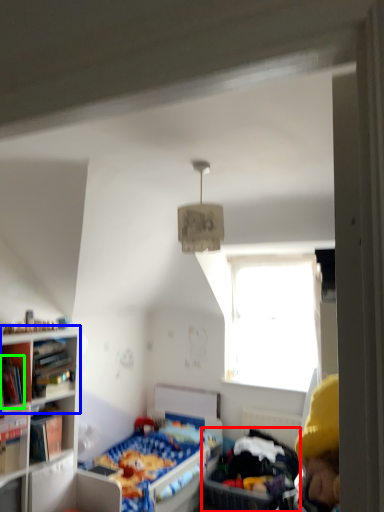
Question: Which object is the farthest from infant bed (highlighted by a red box)? Choose among these: shelf (highlighted by a blue box) or book (highlighted by a green box).

Choices:
 (A) shelf
 (B) book

Answer: (B)